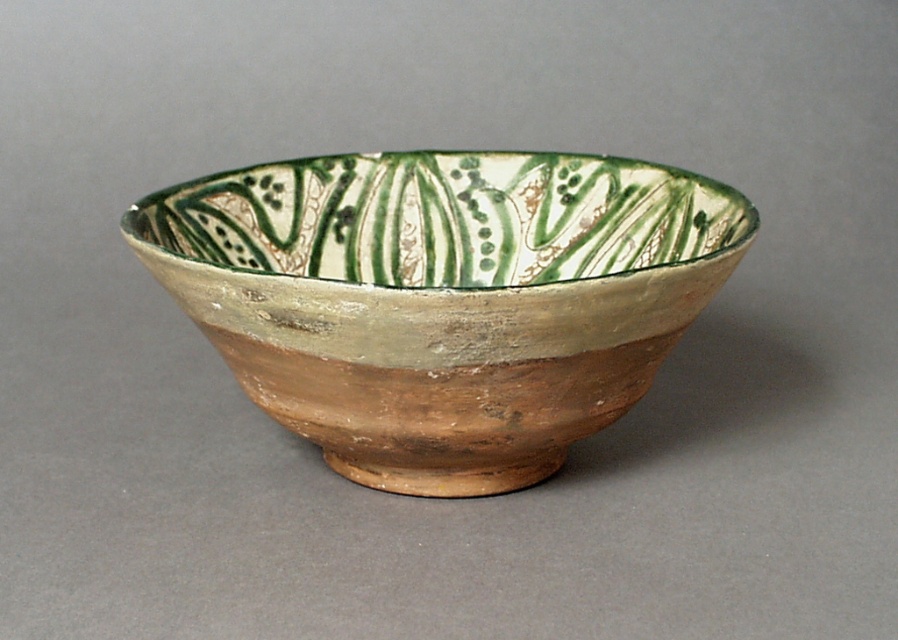
You have two bowls in front of you, a matte clay bowl at center and a green glazed bowl at center. Which one do you think has a larger opening at the top?

The matte clay bowl at center might be wider than the green glazed bowl at center, so it likely has a larger opening at the top.

You are arranging two bowls on a shelf. The matte clay bowl at center and the green glazed bowl at center are both in front of you. Which bowl is located to the left when viewed from the front?

The matte clay bowl at center is positioned on the left side of the green glazed bowl at center, so it is the one located to the left when viewed from the front.

You are standing in front of a ceramic bowl. The bowl has a handmade design with a warm brown exterior and a green glaze interior. There is a specific point marked at coordinates point (443,298). Can you determine if this point is located on the matte clay bowl at center?

The point (443,298) represents the matte clay bowl at center, so yes, the point is located on the matte clay bowl at center.